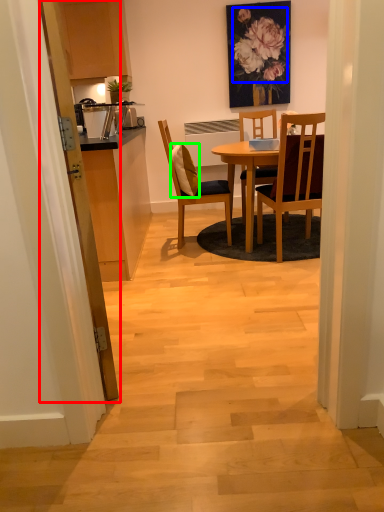
Question: Estimate the real-world distances between objects in this image. Which object is farther from glass door (highlighted by a red box), flower (highlighted by a blue box) or pillow (highlighted by a green box)?

Choices:
 (A) flower
 (B) pillow

Answer: (A)